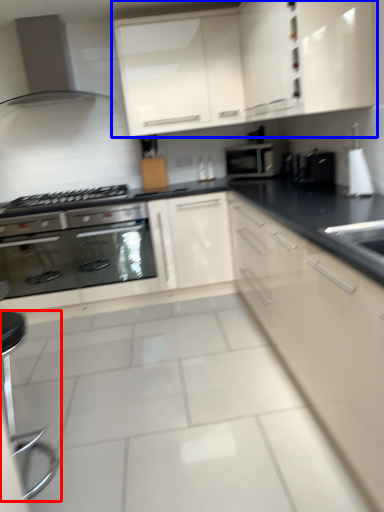
Question: Which point is further to the camera, bar stool (highlighted by a red box) or cabinetry (highlighted by a blue box)?

Choices:
 (A) bar stool
 (B) cabinetry

Answer: (B)